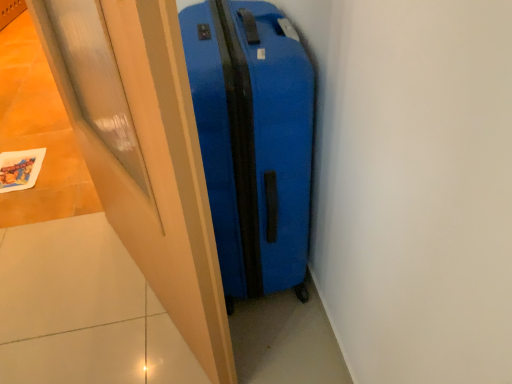
The image size is (512, 384). Identify the location of free location to the left of matte wood door at center. (67, 289).